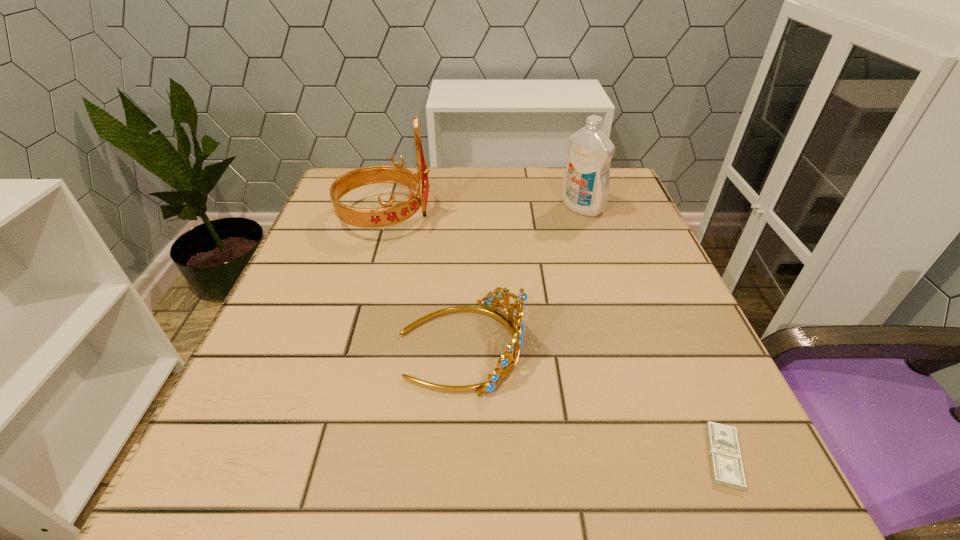
In the image, there is a desktop. Where is `vacant region at the left edge`? The height and width of the screenshot is (540, 960). vacant region at the left edge is located at coordinates (291, 340).

What are the coordinates of `vacant space at the right edge of the desktop` in the screenshot? It's located at (640, 266).

In the image, there is a desktop. What are the coordinates of `free space at the far left corner` in the screenshot? It's located at (373, 185).

The width and height of the screenshot is (960, 540). Find the location of `vacant space at the near left corner of the desktop`. vacant space at the near left corner of the desktop is located at coordinates (219, 464).

This screenshot has width=960, height=540. In order to click on empty location between the taller tiara and the second nearest object in this screenshot , I will do `click(423, 281)`.

Locate an element on the screen. free space that is in between the detergent and the money is located at coordinates (653, 332).

I want to click on vacant region between the second object from right to left and the taller tiara, so [x=484, y=212].

Where is `empty space that is in between the taller tiara and the rightmost object`? This screenshot has height=540, width=960. empty space that is in between the taller tiara and the rightmost object is located at coordinates (555, 336).

This screenshot has height=540, width=960. I want to click on blank region between the rightmost object and the second nearest object, so click(592, 401).

Identify the location of vacant space in between the detergent and the shortest object. Image resolution: width=960 pixels, height=540 pixels. (653, 332).